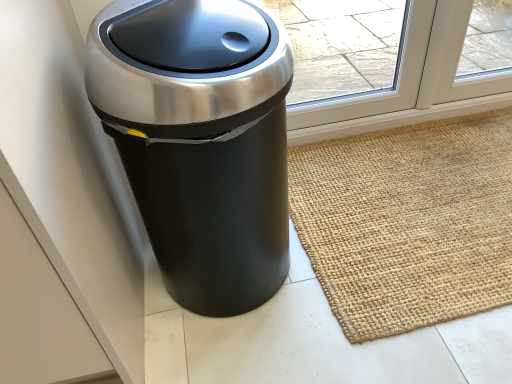
This screenshot has height=384, width=512. Describe the element at coordinates (200, 140) in the screenshot. I see `satin black trash can at left` at that location.

The height and width of the screenshot is (384, 512). What are the coordinates of `satin black trash can at left` in the screenshot? It's located at (200, 140).

What is the approximate height of satin black trash can at left?

26.45 inches.

Describe the element at coordinates (408, 222) in the screenshot. I see `natural jute doormat at lower right` at that location.

Locate an element on the screen. This screenshot has height=384, width=512. natural jute doormat at lower right is located at coordinates (408, 222).

Where is `satin black trash can at left`? satin black trash can at left is located at coordinates (200, 140).

Visually, is natural jute doormat at lower right positioned to the left or to the right of satin black trash can at left?

Clearly, natural jute doormat at lower right is on the right of satin black trash can at left in the image.

Between natural jute doormat at lower right and satin black trash can at left, which one is positioned behind?

Positioned behind is natural jute doormat at lower right.

Is point (451, 172) more distant than point (253, 41)?

Yes, it is behind point (253, 41).

From the image's perspective, which one is positioned lower, natural jute doormat at lower right or satin black trash can at left?

natural jute doormat at lower right.

From a real-world perspective, which object rests below the other?

natural jute doormat at lower right, from a real-world perspective.

Consider the image. Can you confirm if natural jute doormat at lower right is wider than satin black trash can at left?

Yes, natural jute doormat at lower right is wider than satin black trash can at left.

In terms of height, does natural jute doormat at lower right look taller or shorter compared to satin black trash can at left?

natural jute doormat at lower right is shorter than satin black trash can at left.

Can you confirm if natural jute doormat at lower right is bigger than satin black trash can at left?

No.

Can we say natural jute doormat at lower right lies outside satin black trash can at left?

natural jute doormat at lower right lies outside satin black trash can at left's area.

Is natural jute doormat at lower right with satin black trash can at left?

No, natural jute doormat at lower right is not beside satin black trash can at left.

Is natural jute doormat at lower right turned away from satin black trash can at left?

No, satin black trash can at left is not at the back of natural jute doormat at lower right.

How many degrees apart are the facing directions of natural jute doormat at lower right and satin black trash can at left?

The facing directions of natural jute doormat at lower right and satin black trash can at left are 0.753 degrees apart.

Find the location of a particular element. This screenshot has height=384, width=512. waste container in front of the natural jute doormat at lower right is located at coordinates (200, 140).

Is satin black trash can at left at the right side of natural jute doormat at lower right?

Incorrect, satin black trash can at left is not on the right side of natural jute doormat at lower right.

Relative to natural jute doormat at lower right, is satin black trash can at left in front or behind?

Visually, satin black trash can at left is located in front of natural jute doormat at lower right.

Is point (250, 297) positioned after point (359, 241)?

No, (250, 297) is in front of (359, 241).

From the image's perspective, which is below, satin black trash can at left or natural jute doormat at lower right?

natural jute doormat at lower right appears lower in the image.

From a real-world perspective, between satin black trash can at left and natural jute doormat at lower right, who is vertically lower?

From a 3D spatial view, natural jute doormat at lower right is below.

Does satin black trash can at left have a lesser width compared to natural jute doormat at lower right?

Yes.

Between satin black trash can at left and natural jute doormat at lower right, which one has more height?

satin black trash can at left is taller.

Is satin black trash can at left bigger or smaller than natural jute doormat at lower right?

satin black trash can at left is bigger than natural jute doormat at lower right.

Do you think satin black trash can at left is within natural jute doormat at lower right, or outside of it?

The correct answer is: outside.

Is satin black trash can at left next to natural jute doormat at lower right?

No, satin black trash can at left is not making contact with natural jute doormat at lower right.

Is satin black trash can at left oriented towards natural jute doormat at lower right?

No.

Where is `waste container in front of the natural jute doormat at lower right`? waste container in front of the natural jute doormat at lower right is located at coordinates (200, 140).

Identify the location of waste container above the natural jute doormat at lower right (from a real-world perspective). (200, 140).

You are a GUI agent. You are given a task and a screenshot of the screen. Output one action in this format:
    pyautogui.click(x=<x>, y=<y>)
    Task: Click on the doormat behind the satin black trash can at left
    This screenshot has height=384, width=512.
    Given the screenshot: What is the action you would take?
    pyautogui.click(x=408, y=222)